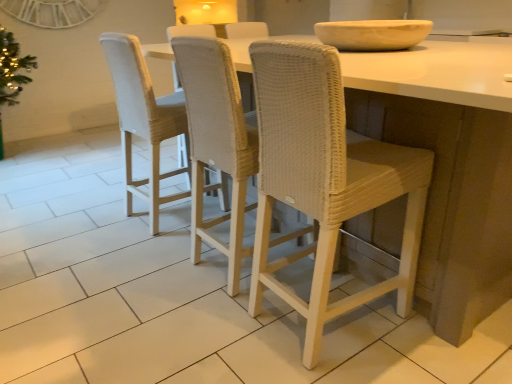
Question: Is woven beige chair at center, marked as the second chair in a right-to-left arrangement, in front of or behind white wicker chair at center, the third chair in the left-to-right sequence, in the image?

Choices:
 (A) front
 (B) behind

Answer: (B)

Question: From a real-world perspective, is woven beige chair at center, marked as the second chair in a right-to-left arrangement, positioned above or below white wicker chair at center, which ranks as the 1th chair in right-to-left order?

Choices:
 (A) above
 (B) below

Answer: (A)

Question: Which object is the closest to the white wicker chair at center, the third chair in the left-to-right sequence?

Choices:
 (A) white woven stool at center
 (B) beige stone bowl at upper center
 (C) woven beige chair at center, marked as the second chair in a right-to-left arrangement
 (D) woven beige chair at center, the 3th chair viewed from the right

Answer: (A)

Question: Which is farther from the woven beige chair at center, which ranks as the 2th chair in left-to-right order?

Choices:
 (A) white wicker chair at center, which ranks as the 1th chair in right-to-left order
 (B) beige stone bowl at upper center
 (C) woven beige chair at center, placed as the first chair when sorted from left to right
 (D) white woven stool at center

Answer: (B)